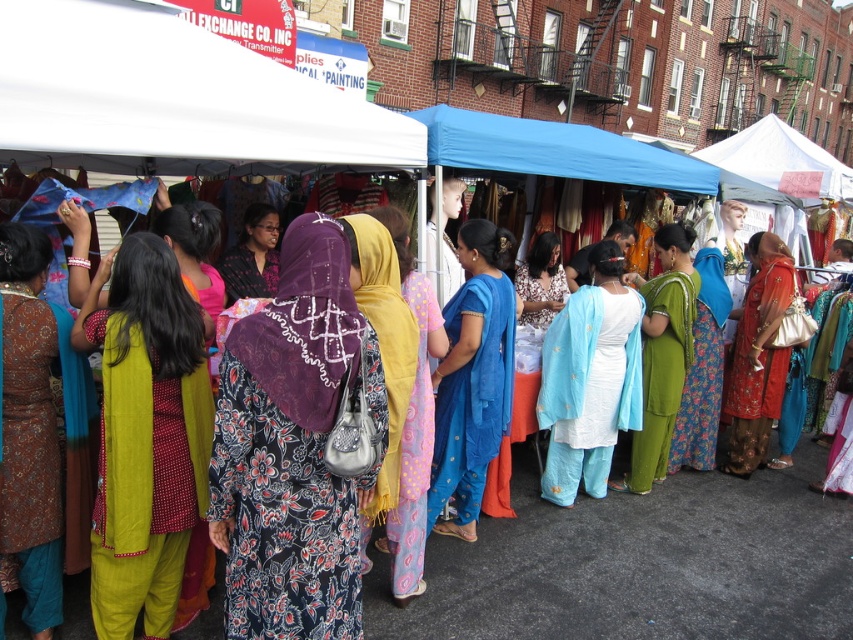
You are a customer at the outdoor market and want to find the matte green dress at center. Based on the coordinates provided, can you determine its position relative to the stalls?

The matte green dress at center is located at point coordinates (144, 435). Since the stalls are positioned under the colorful canopies in the market, the dress is centrally placed within the stalls area.

You are a customer at the market and want to buy a sari that is taller. Which one should you choose between the blue silk sari at center and the green silk sari at center?

The green silk sari at center is taller than the blue silk sari at center, so you should choose the green silk sari at center.

In the scene shown: You are a customer at the market and want to buy a dress and a blouse. You notice two items at the center of the stall. Which one is taller, the matte green dress at center or the matte black blouse at center?

The matte green dress at center is much taller as the matte black blouse at center.